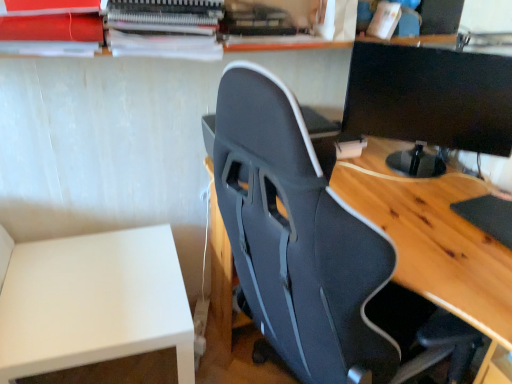
In order to click on white matte table at lower left in this screenshot , I will do `click(93, 302)`.

Image resolution: width=512 pixels, height=384 pixels. What are the coordinates of `black fabric chair at center` in the screenshot? It's located at (304, 243).

Is black fabric chair at center looking in the opposite direction of white matte table at lower left?

No, black fabric chair at center is not facing the opposite direction of white matte table at lower left.

Considering the relative positions of black fabric chair at center and white matte table at lower left in the image provided, is black fabric chair at center to the right of white matte table at lower left from the viewer's perspective?

Yes, black fabric chair at center is to the right of white matte table at lower left.

Which of these two, black fabric chair at center or white matte table at lower left, is thinner?

white matte table at lower left.

Where is `table behind the black fabric chair at center`? table behind the black fabric chair at center is located at coordinates (93, 302).

Considering the positions of objects black glossy monitor at upper right and black fabric chair at center in the image provided, who is more to the left, black glossy monitor at upper right or black fabric chair at center?

black fabric chair at center is more to the left.

Considering the sizes of objects black glossy monitor at upper right and black fabric chair at center in the image provided, who is wider, black glossy monitor at upper right or black fabric chair at center?

black fabric chair at center.

Is black glossy monitor at upper right located outside black fabric chair at center?

black glossy monitor at upper right is positioned outside black fabric chair at center.

Is black glossy monitor at upper right taller or shorter than black fabric chair at center?

Clearly, black glossy monitor at upper right is shorter compared to black fabric chair at center.

Is black fabric chair at center positioned with its back to black glossy monitor at upper right?

No, black glossy monitor at upper right is not at the back of black fabric chair at center.

Identify the location of computer monitor above the black fabric chair at center (from a real-world perspective). (429, 102).

From the image's perspective, does black fabric chair at center appear lower than black glossy monitor at upper right?

Yes, from the image's perspective, black fabric chair at center is below black glossy monitor at upper right.

Is there a large distance between black fabric chair at center and black glossy monitor at upper right?

black fabric chair at center is actually quite close to black glossy monitor at upper right.

Can you confirm if black glossy monitor at upper right is shorter than white matte table at lower left?

Correct, black glossy monitor at upper right is not as tall as white matte table at lower left.

Considering the positions of objects black glossy monitor at upper right and white matte table at lower left in the image provided, who is behind, black glossy monitor at upper right or white matte table at lower left?

black glossy monitor at upper right is behind.

Considering the sizes of objects black glossy monitor at upper right and white matte table at lower left in the image provided, who is smaller, black glossy monitor at upper right or white matte table at lower left?

With smaller size is black glossy monitor at upper right.

Can you confirm if black glossy monitor at upper right is thinner than white matte table at lower left?

Correct, the width of black glossy monitor at upper right is less than that of white matte table at lower left.

Does white matte table at lower left touch black glossy monitor at upper right?

No, white matte table at lower left is not with black glossy monitor at upper right.

From the image's perspective, is white matte table at lower left located above or below black glossy monitor at upper right?

Clearly, from the image's perspective, white matte table at lower left is below black glossy monitor at upper right.

From a real-world perspective, is white matte table at lower left physically located above or below black glossy monitor at upper right?

In terms of real-world spatial position, white matte table at lower left is below black glossy monitor at upper right.

Consider the image. Are white matte table at lower left and black fabric chair at center making contact?

No, white matte table at lower left is not next to black fabric chair at center.

Who is taller, white matte table at lower left or black fabric chair at center?

Standing taller between the two is black fabric chair at center.

Consider the image. From a real-world perspective, does white matte table at lower left stand above black fabric chair at center?

No, from a real-world perspective, white matte table at lower left is not over black fabric chair at center

Between white matte table at lower left and black fabric chair at center, which one has smaller size?

white matte table at lower left is smaller.

Where is `chair positioned vertically above the white matte table at lower left (from a real-world perspective)`? The width and height of the screenshot is (512, 384). chair positioned vertically above the white matte table at lower left (from a real-world perspective) is located at coordinates (304, 243).

This screenshot has width=512, height=384. Identify the location of computer monitor on the right of black fabric chair at center. (429, 102).

When comparing their distances from white matte table at lower left, does black glossy monitor at upper right or black fabric chair at center seem closer?

black fabric chair at center is positioned closer to the anchor white matte table at lower left.

Looking at the image, which one is located closer to black glossy monitor at upper right, white matte table at lower left or black fabric chair at center?

black fabric chair at center is positioned closer to the anchor black glossy monitor at upper right.

Considering their positions, is black fabric chair at center positioned closer to black glossy monitor at upper right than white matte table at lower left?

black fabric chair at center is closer to black glossy monitor at upper right.

When comparing their distances from white matte table at lower left, does black fabric chair at center or black glossy monitor at upper right seem further?

black glossy monitor at upper right.

From the image, which object appears to be nearer to black fabric chair at center, white matte table at lower left or black glossy monitor at upper right?

white matte table at lower left lies closer to black fabric chair at center than the other object.

Looking at the image, which one is located further to black fabric chair at center, black glossy monitor at upper right or white matte table at lower left?

black glossy monitor at upper right lies further to black fabric chair at center than the other object.

Where is `chair situated between white matte table at lower left and black glossy monitor at upper right from left to right`? The height and width of the screenshot is (384, 512). chair situated between white matte table at lower left and black glossy monitor at upper right from left to right is located at coordinates (304, 243).